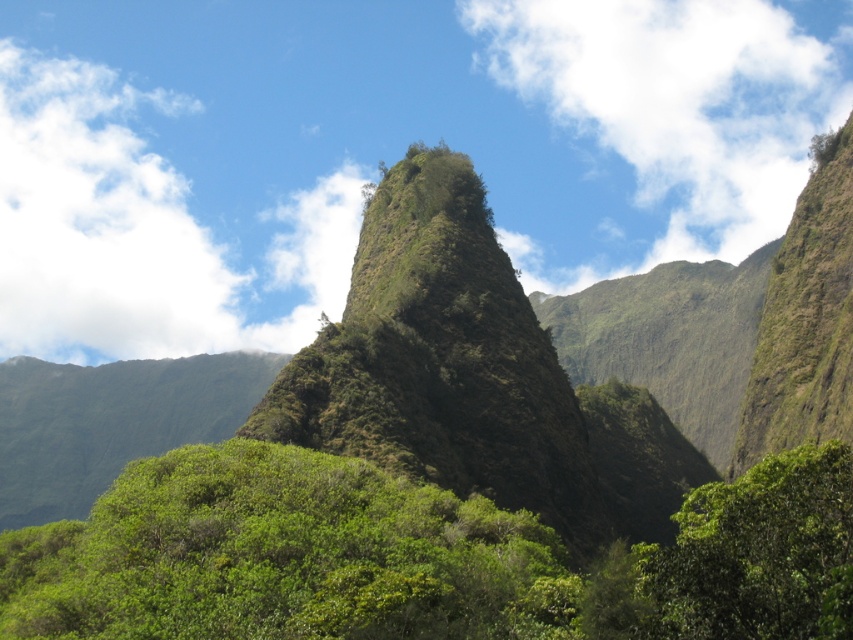
You are standing at the point marked by point (488, 369) in the image. What is the immediate terrain feature you are on?

The point (488, 369) marks the green rocky mountain at center, so you are on the green rocky mountain at center.

You are standing at the base of the central mountain and see the green leafy tree at center and the green leafy tree at lower right. Which tree is closer to you?

The green leafy tree at lower right is closer to you because it is positioned below the green leafy tree at center, indicating it is nearer in the scene.

Based on the photo, you are a hiker planning to take a photo of the green leafy tree at lower right from the base of the green rocky mountain at center. Considering the height difference between them, will you be able to frame the entire tree in your camera without needing to move closer or farther away?

The green rocky mountain at center is much taller than the green leafy tree at lower right, so you can frame the entire tree in your camera without needing to move closer or farther away because the tree is smaller and positioned lower in the scene.